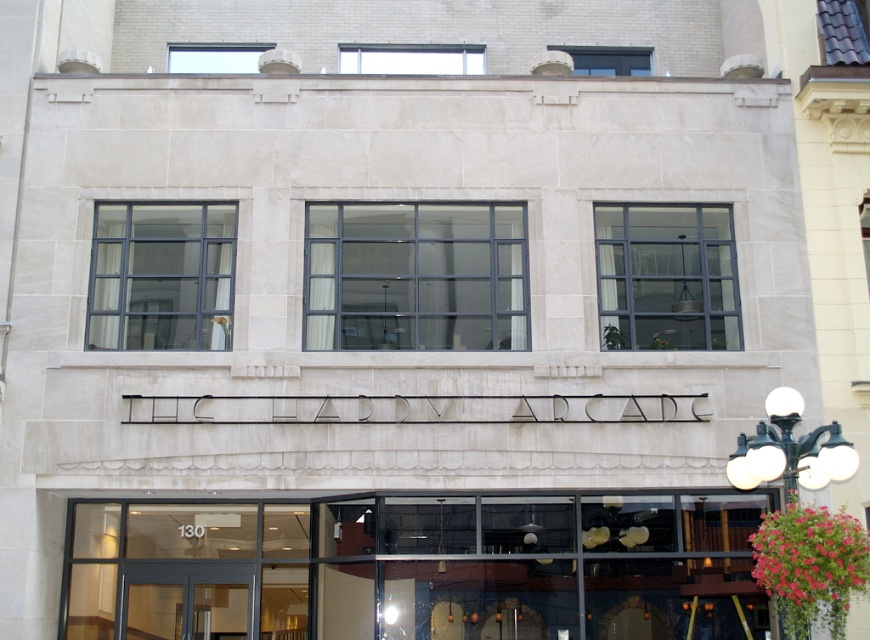
Question: Which object is the closest to the clear glass doors at lower center?

Choices:
 (A) clear glass door at lower center
 (B) black metal streetlamp at upper right

Answer: (A)

Question: Can you confirm if clear glass doors at lower center is positioned below clear glass door at lower center?

Choices:
 (A) yes
 (B) no

Answer: (A)

Question: Can you confirm if clear glass doors at lower center is wider than black metal streetlamp at upper right?

Choices:
 (A) no
 (B) yes

Answer: (B)

Question: Is clear glass doors at lower center positioned at the back of clear glass door at lower center?

Choices:
 (A) yes
 (B) no

Answer: (B)

Question: Which of the following is the closest to the observer?

Choices:
 (A) 611,620
 (B) 246,636

Answer: (B)

Question: Among these objects, which one is nearest to the camera?

Choices:
 (A) clear glass door at lower center
 (B) black metal streetlamp at upper right
 (C) clear glass doors at lower center

Answer: (B)